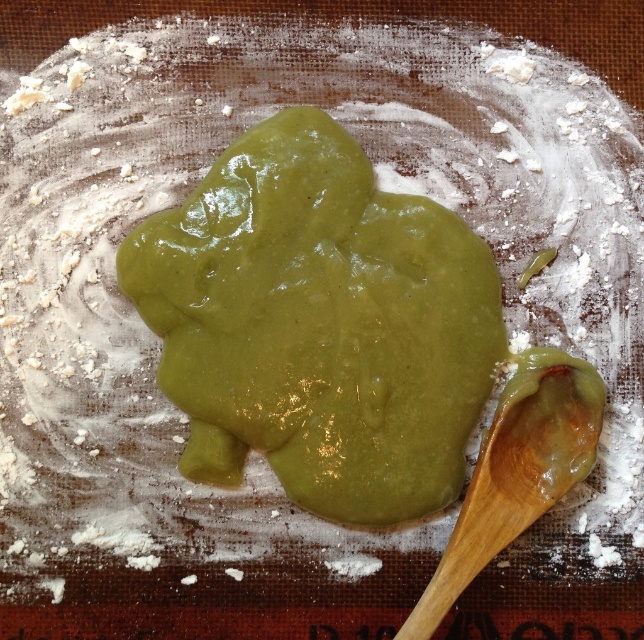
Does green glossy paste at center have a smaller size compared to wooden spoon at lower right?

No.

Between green glossy paste at center and wooden spoon at lower right, which one is positioned lower?

wooden spoon at lower right is lower down.

Find the location of `green glossy paste at center`. green glossy paste at center is located at coordinates 319,324.